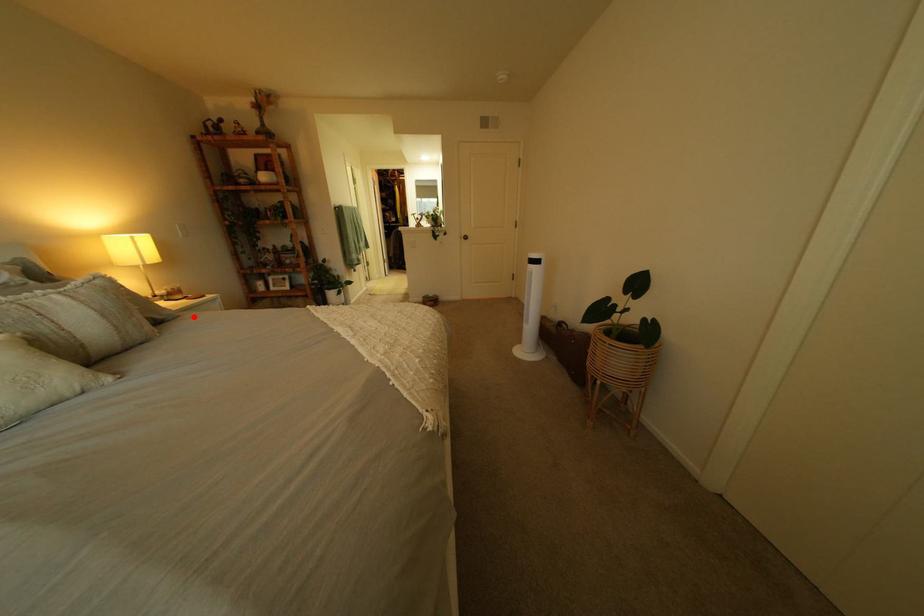
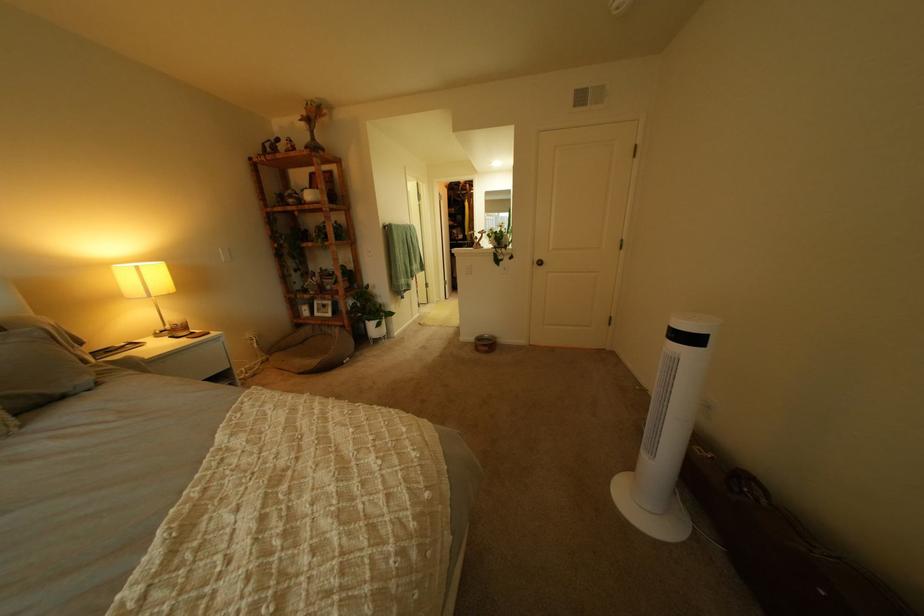
Question: I am providing you with two images of the same scene from different viewpoints. Given a red point in image1, look at the same physical point in image2. Is it:

Choices:
 (A) Closer to the viewpoint
 (B) Farther from the viewpoint

Answer: (B)